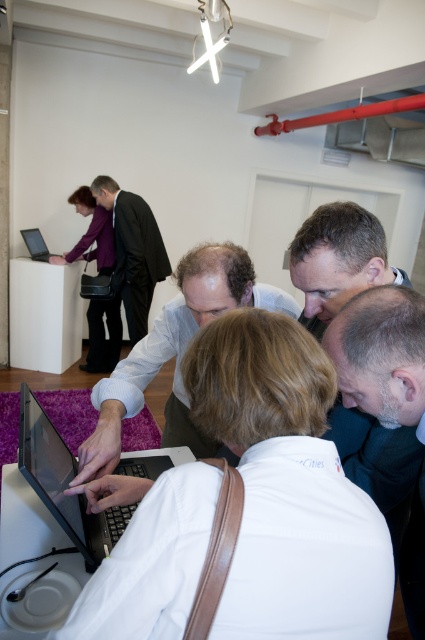
Is light blue shirt at center in front of matte black laptop at left?

Yes.

From the picture: Is light blue shirt at center further to the viewer compared to matte black laptop at left?

No, light blue shirt at center is closer to the viewer.

Between point (105, 445) and point (104, 344), which one is positioned in front?

Point (105, 445) is in front.

This screenshot has width=425, height=640. In order to click on light blue shirt at center in this screenshot , I will do `click(175, 353)`.

Can you confirm if matte black suit at upper left is positioned to the right of matte black laptop at upper left?

Indeed, matte black suit at upper left is positioned on the right side of matte black laptop at upper left.

In the scene shown: Who is positioned more to the right, matte black suit at upper left or matte black laptop at upper left?

matte black suit at upper left

Is point (141, 298) in front of point (42, 260)?

Yes, point (141, 298) is in front of point (42, 260).

Locate an element on the screen. Image resolution: width=425 pixels, height=640 pixels. matte black suit at upper left is located at coordinates (133, 252).

Is matte black laptop at left to the left of matte black laptop at upper left from the viewer's perspective?

No, matte black laptop at left is not to the left of matte black laptop at upper left.

Is point (104, 262) positioned behind point (20, 232)?

Yes, point (104, 262) is farther from viewer.

Is point (88, 211) positioned after point (27, 237)?

Yes, it is behind point (27, 237).

At what (x,y) coordinates should I click in order to perform the action: click on matte black laptop at left. Please return your answer as a coordinate pair (x, y). Looking at the image, I should click on (91, 234).